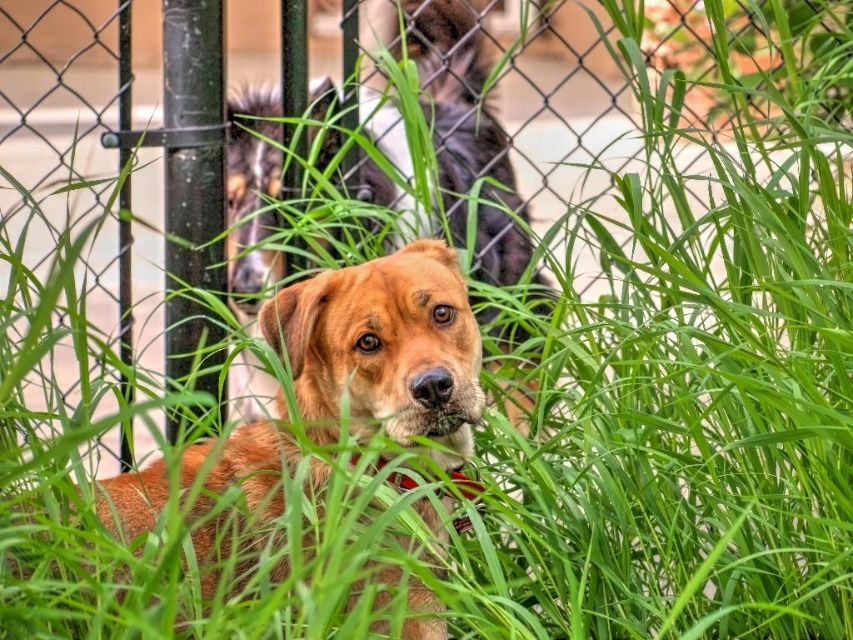
You are a photographer trying to capture the dog in the scene. You notice the golden brown fur at center and the red fabric collar at center. Which one of these is larger in size?

The golden brown fur at center is bigger than the red fabric collar at center, so the golden brown fur at center is larger in size.

Consider the image. You are a photographer trying to capture a closeup of the golden brown fur at center and the red fabric collar at center. Which one should you zoom in on to ensure both are in focus without moving the camera?

The golden brown fur at center is wider than the red fabric collar at center, so zooming in on the golden brown fur at center will ensure both are in focus since it covers a larger area.

Based on the scene description, where is the golden brown fur at center located in the image?

The golden brown fur at center is located at point (462, 129) in the image.